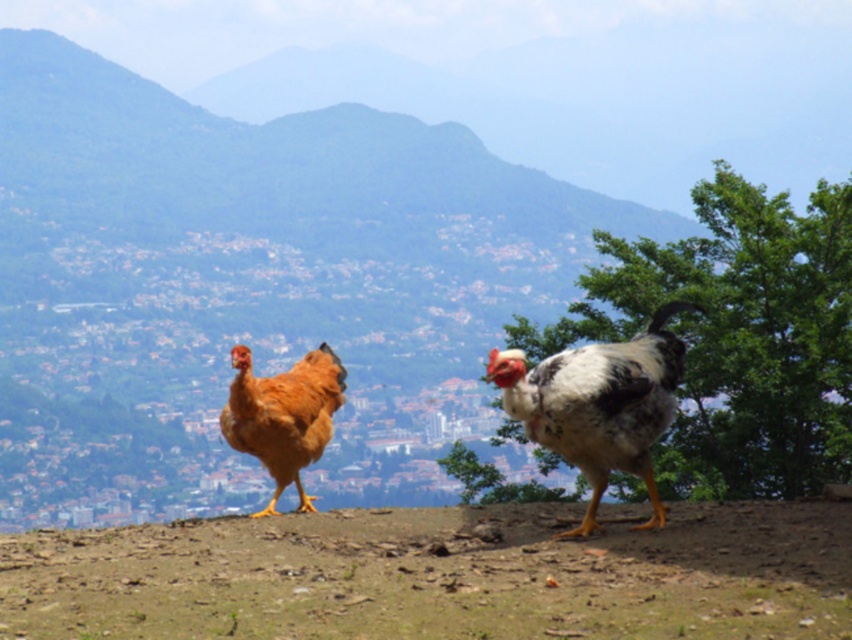
From the picture: Between white speckled feather at center and golden feathered chicken at center, which one appears on the left side from the viewer's perspective?

Positioned to the left is golden feathered chicken at center.

Based on the photo, between white speckled feather at center and golden feathered chicken at center, which one has more height?

white speckled feather at center is taller.

Is point (594, 448) behind point (301, 452)?

No, (594, 448) is closer to viewer.

I want to click on white speckled feather at center, so click(597, 404).